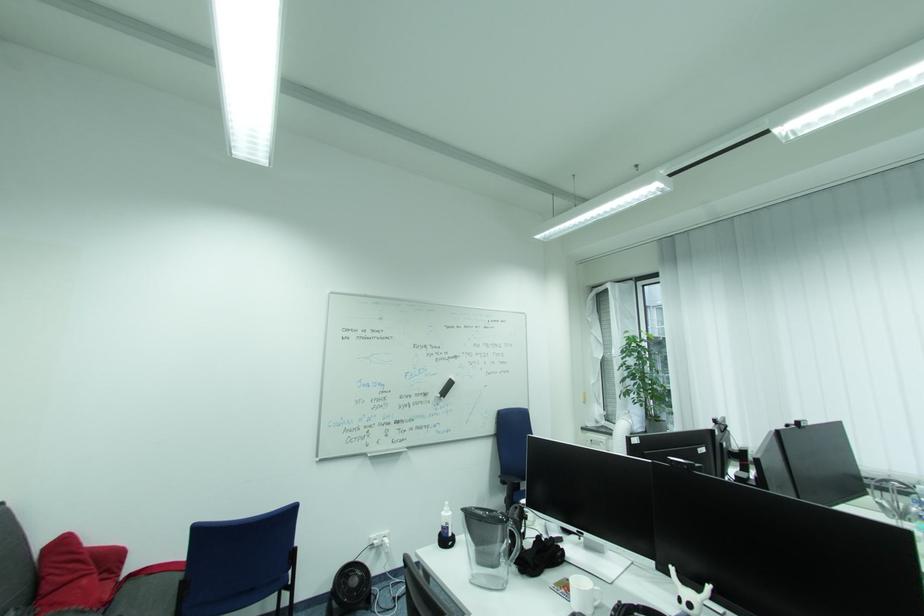
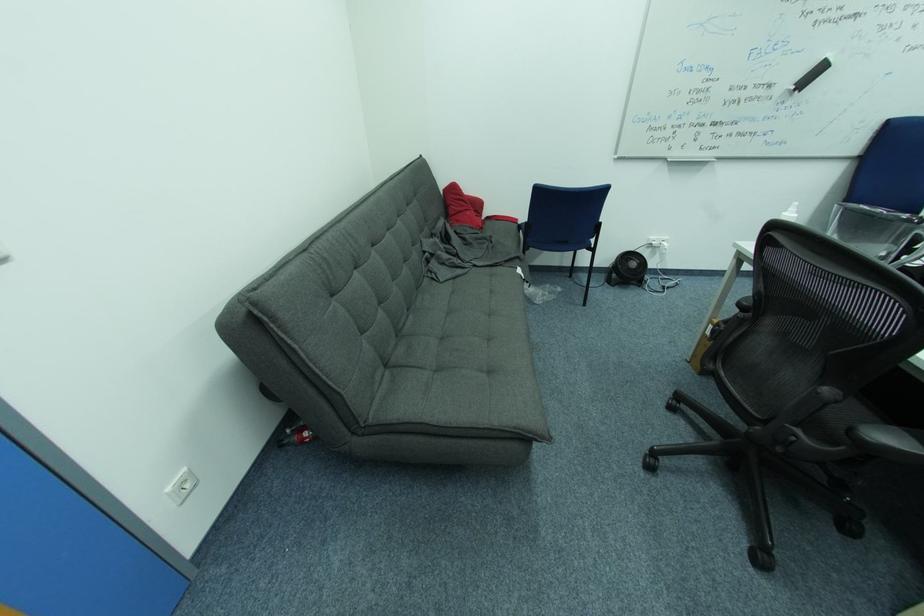
In the second image, find the point that corresponds to point 70,543 in the first image.

(459, 188)